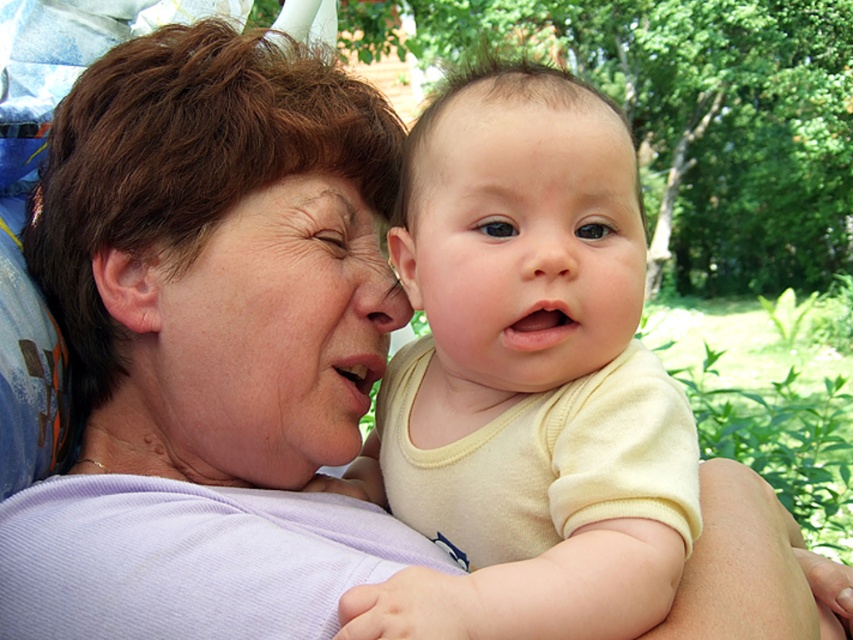
Does smooth cream baby at center have a larger size compared to smooth skin face at center?

Correct, smooth cream baby at center is larger in size than smooth skin face at center.

Does point (560, 365) lie in front of point (270, 340)?

That is True.

Find the location of a particular element. The height and width of the screenshot is (640, 853). smooth cream baby at center is located at coordinates (521, 243).

Does smooth cream baby at center come in front of matte skin nose at center?

Yes, it is.

I want to click on smooth cream baby at center, so click(x=521, y=243).

Which of these two, smooth cream shirt at center or matte skin nose at center, stands taller?

smooth cream shirt at center is taller.

Between point (627, 547) and point (392, 296), which one is positioned in front?

Positioned in front is point (627, 547).

This screenshot has width=853, height=640. In order to click on smooth cream shirt at center in this screenshot , I will do `click(525, 381)`.